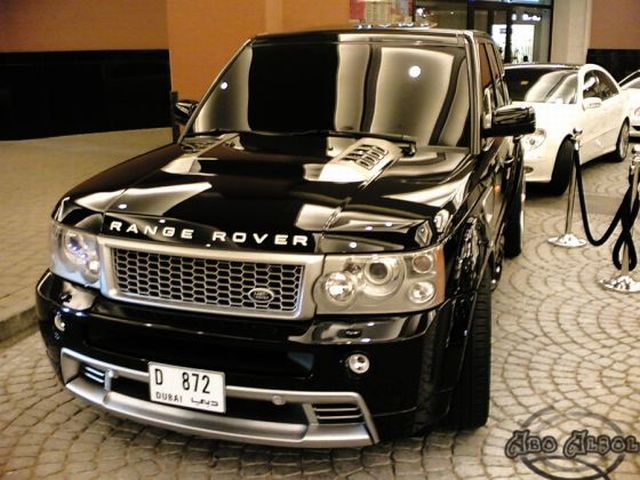
In order to click on tan wall in this screenshot , I will do `click(132, 12)`, `click(310, 11)`, `click(616, 26)`.